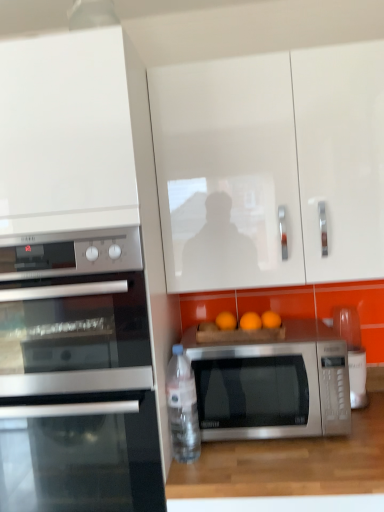
Consider the image. What is the approximate height of wooden at lower center?

The height of wooden at lower center is 20.31 inches.

I want to click on wooden at lower center, so click(x=289, y=464).

Describe the element at coordinates (353, 353) in the screenshot. I see `white glossy microwave at right` at that location.

What do you see at coordinates (182, 407) in the screenshot?
I see `clear plastic bottle at lower center` at bounding box center [182, 407].

Image resolution: width=384 pixels, height=512 pixels. What do you see at coordinates (272, 384) in the screenshot?
I see `satin silver microwave at center, positioned as the second microwave oven in left-to-right order` at bounding box center [272, 384].

The height and width of the screenshot is (512, 384). Describe the element at coordinates (271, 168) in the screenshot. I see `white glossy cabinet at upper center, placed as the 2th cabinetry when sorted from left to right` at that location.

You are a GUI agent. You are given a task and a screenshot of the screen. Output one action in this format:
    pyautogui.click(x=<x>, y=<y>)
    Task: Click on the white glossy cabinet at upper center, placed as the 2th cabinetry when sorted from left to right
    
    Given the screenshot: What is the action you would take?
    pyautogui.click(x=271, y=168)

Identify the location of satin silver microwave at left, the 2th microwave oven positioned from the right. point(74,314).

Between white glossy cabinet at upper left, which is the 2th cabinetry from right to left, and satin black oven at left, which one has larger width?

Wider between the two is white glossy cabinet at upper left, which is the 2th cabinetry from right to left.

Is white glossy cabinet at upper left, which appears as the first cabinetry when viewed from the left, aimed at satin black oven at left?

No, white glossy cabinet at upper left, which appears as the first cabinetry when viewed from the left, is not facing towards satin black oven at left.

What are the coordinates of `cabinetry located in front of the satin black oven at left` in the screenshot? It's located at (65, 134).

From a real-world perspective, is white glossy cabinet at upper left, which is the 2th cabinetry from right to left, positioned above or below satin black oven at left?

white glossy cabinet at upper left, which is the 2th cabinetry from right to left, is above satin black oven at left.

Is white glossy microwave at right closer to camera compared to white glossy cabinet at upper left, which appears as the first cabinetry when viewed from the left?

No, white glossy microwave at right is further to the viewer.

Considering the positions of objects white glossy microwave at right and white glossy cabinet at upper left, which is the 2th cabinetry from right to left, in the image provided, who is more to the right, white glossy microwave at right or white glossy cabinet at upper left, which is the 2th cabinetry from right to left,?

white glossy microwave at right is more to the right.

From a real-world perspective, between white glossy microwave at right and white glossy cabinet at upper left, which appears as the first cabinetry when viewed from the left, who is vertically lower?

From a 3D spatial view, white glossy microwave at right is below.

Is white glossy microwave at right touching white glossy cabinet at upper left, which appears as the first cabinetry when viewed from the left?

No, white glossy microwave at right is not in contact with white glossy cabinet at upper left, which appears as the first cabinetry when viewed from the left.

This screenshot has width=384, height=512. What are the coordinates of `bottle below the white glossy cabinet at upper center, placed as the first cabinetry when sorted from right to left (from the image's perspective)` in the screenshot? It's located at (182, 407).

From a real-world perspective, who is located higher, clear plastic bottle at lower center or white glossy cabinet at upper center, placed as the first cabinetry when sorted from right to left?

white glossy cabinet at upper center, placed as the first cabinetry when sorted from right to left, is physically above.

Is clear plastic bottle at lower center thinner than white glossy cabinet at upper center, placed as the first cabinetry when sorted from right to left?

Yes.

In the scene shown: Which is more to the right, clear plastic bottle at lower center or white glossy cabinet at upper center, placed as the first cabinetry when sorted from right to left?

Positioned to the right is white glossy cabinet at upper center, placed as the first cabinetry when sorted from right to left.

Considering the positions of objects satin silver microwave at center, placed as the first microwave oven when sorted from right to left, and white glossy microwave at right in the image provided, who is in front, satin silver microwave at center, placed as the first microwave oven when sorted from right to left, or white glossy microwave at right?

satin silver microwave at center, placed as the first microwave oven when sorted from right to left, is in front.

From a real-world perspective, who is located lower, satin silver microwave at center, placed as the first microwave oven when sorted from right to left, or white glossy microwave at right?

satin silver microwave at center, placed as the first microwave oven when sorted from right to left.

From the image's perspective, relative to white glossy microwave at right, is satin silver microwave at center, positioned as the second microwave oven in left-to-right order, above or below?

Based on their image positions, satin silver microwave at center, positioned as the second microwave oven in left-to-right order, is located beneath white glossy microwave at right.

Is satin silver microwave at center, placed as the first microwave oven when sorted from right to left, facing away from white glossy microwave at right?

satin silver microwave at center, placed as the first microwave oven when sorted from right to left, does not have its back to white glossy microwave at right.

Could you tell me if satin black oven at left is facing clear plastic bottle at lower center?

No.

Is satin black oven at left at the left side of clear plastic bottle at lower center?

Correct, you'll find satin black oven at left to the left of clear plastic bottle at lower center.

Can you tell me how much satin black oven at left and clear plastic bottle at lower center differ in facing direction?

There is a 0.00468-degree angle between the facing directions of satin black oven at left and clear plastic bottle at lower center.

Between point (80, 404) and point (181, 386), which one is positioned behind?

The point (181, 386) is more distant.

Is satin silver microwave at center, placed as the first microwave oven when sorted from right to left, thinner than satin black oven at left?

Yes, satin silver microwave at center, placed as the first microwave oven when sorted from right to left, is thinner than satin black oven at left.

Is satin black oven at left at the back of satin silver microwave at center, positioned as the second microwave oven in left-to-right order?

No, satin silver microwave at center, positioned as the second microwave oven in left-to-right order, is not facing away from satin black oven at left.

How many degrees apart are the facing directions of satin silver microwave at center, positioned as the second microwave oven in left-to-right order, and satin black oven at left?

0.00115 degrees separate the facing orientations of satin silver microwave at center, positioned as the second microwave oven in left-to-right order, and satin black oven at left.

Where is `oven that appears on the left of satin silver microwave at center, positioned as the second microwave oven in left-to-right order`? This screenshot has width=384, height=512. oven that appears on the left of satin silver microwave at center, positioned as the second microwave oven in left-to-right order is located at coordinates (82, 454).

Between clear plastic bottle at lower center and satin black oven at left, which one has less height?

Standing shorter between the two is clear plastic bottle at lower center.

Consider the image. How many degrees apart are the facing directions of clear plastic bottle at lower center and satin black oven at left?

clear plastic bottle at lower center and satin black oven at left are facing 0.00468 degrees away from each other.

Considering the sizes of clear plastic bottle at lower center and satin black oven at left in the image, is clear plastic bottle at lower center wider or thinner than satin black oven at left?

Clearly, clear plastic bottle at lower center has less width compared to satin black oven at left.

Find the location of a particular element. bottle behind the satin black oven at left is located at coordinates (182, 407).

Image resolution: width=384 pixels, height=512 pixels. What are the coordinates of `cabinetry in front of the satin black oven at left` in the screenshot? It's located at (65, 134).

Find the location of a particular element. This screenshot has height=512, width=384. appliance below the white glossy cabinet at upper left, which is the 2th cabinetry from right to left (from the image's perspective) is located at coordinates (353, 353).

Which object lies further to the anchor point white glossy microwave at right, satin silver microwave at left, positioned as the 1th microwave oven in left-to-right order, or satin black oven at left?

satin silver microwave at left, positioned as the 1th microwave oven in left-to-right order, lies further to white glossy microwave at right than the other object.

Estimate the real-world distances between objects in this image. Which object is further from white glossy cabinet at upper center, placed as the first cabinetry when sorted from right to left, satin black oven at left or wooden at lower center?

wooden at lower center is further to white glossy cabinet at upper center, placed as the first cabinetry when sorted from right to left.

Looking at the image, which one is located further to wooden at lower center, satin silver microwave at left, positioned as the 1th microwave oven in left-to-right order, or clear plastic bottle at lower center?

The object further to wooden at lower center is satin silver microwave at left, positioned as the 1th microwave oven in left-to-right order.

Estimate the real-world distances between objects in this image. Which object is further from white glossy cabinet at upper left, which appears as the first cabinetry when viewed from the left, satin silver microwave at left, the 2th microwave oven positioned from the right, or satin silver microwave at center, positioned as the second microwave oven in left-to-right order?

Among the two, satin silver microwave at center, positioned as the second microwave oven in left-to-right order, is located further to white glossy cabinet at upper left, which appears as the first cabinetry when viewed from the left.

Estimate the real-world distances between objects in this image. Which object is further from satin silver microwave at center, placed as the first microwave oven when sorted from right to left, satin black oven at left or satin silver microwave at left, the 2th microwave oven positioned from the right?

satin silver microwave at left, the 2th microwave oven positioned from the right, lies further to satin silver microwave at center, placed as the first microwave oven when sorted from right to left, than the other object.

Considering their positions, is satin silver microwave at left, positioned as the 1th microwave oven in left-to-right order, positioned closer to white glossy microwave at right than white glossy cabinet at upper left, which is the 2th cabinetry from right to left?

satin silver microwave at left, positioned as the 1th microwave oven in left-to-right order.

Based on their spatial positions, is clear plastic bottle at lower center or satin silver microwave at left, positioned as the 1th microwave oven in left-to-right order, further from satin silver microwave at center, positioned as the second microwave oven in left-to-right order?

satin silver microwave at left, positioned as the 1th microwave oven in left-to-right order.

Based on their spatial positions, is satin silver microwave at center, positioned as the second microwave oven in left-to-right order, or satin silver microwave at left, the 2th microwave oven positioned from the right, closer to white glossy cabinet at upper left, which is the 2th cabinetry from right to left?

satin silver microwave at left, the 2th microwave oven positioned from the right, is positioned closer to the anchor white glossy cabinet at upper left, which is the 2th cabinetry from right to left.

At what (x,y) coordinates should I click in order to perform the action: click on counter top between clear plastic bottle at lower center and white glossy microwave at right from left to right. Please return your answer as a coordinate pair (x, y). This screenshot has height=512, width=384. Looking at the image, I should click on (289, 464).

What are the coordinates of `oven between satin silver microwave at left, positioned as the 1th microwave oven in left-to-right order, and satin silver microwave at center, placed as the first microwave oven when sorted from right to left` in the screenshot? It's located at (82, 454).

At what (x,y) coordinates should I click in order to perform the action: click on bottle situated between satin silver microwave at left, the 2th microwave oven positioned from the right, and wooden at lower center from left to right. Please return your answer as a coordinate pair (x, y). The width and height of the screenshot is (384, 512). Looking at the image, I should click on (182, 407).

Locate an element on the screen. The width and height of the screenshot is (384, 512). oven that lies between white glossy cabinet at upper left, which is the 2th cabinetry from right to left, and wooden at lower center from top to bottom is located at coordinates (82, 454).